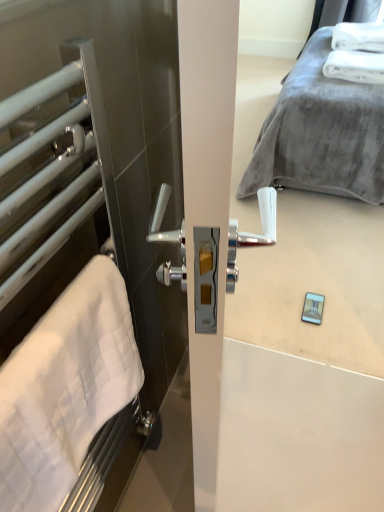
Question: Does white soft towel at upper right, the 1th bath towel positioned from the right, come in front of white matte towel rack at left?

Choices:
 (A) yes
 (B) no

Answer: (B)

Question: Does white soft towel at upper right, positioned as the first bath towel in back-to-front order, come behind white matte towel rack at left?

Choices:
 (A) yes
 (B) no

Answer: (A)

Question: Is white soft towel at upper right, the second bath towel viewed from the left, completely or partially outside of white matte towel rack at left?

Choices:
 (A) yes
 (B) no

Answer: (A)

Question: Considering the relative sizes of white soft towel at upper right, the 1th bath towel positioned from the right, and white matte towel rack at left in the image provided, is white soft towel at upper right, the 1th bath towel positioned from the right, thinner than white matte towel rack at left?

Choices:
 (A) no
 (B) yes

Answer: (A)

Question: Does white soft towel at upper right, the 2th bath towel ordered from the bottom, turn towards white matte towel rack at left?

Choices:
 (A) yes
 (B) no

Answer: (B)

Question: From the image's perspective, is white matte towel rack at left located above or below white soft towel at left, marked as the first bath towel in a bottom-to-top arrangement?

Choices:
 (A) above
 (B) below

Answer: (A)

Question: Considering their positions, is white matte towel rack at left located in front of or behind white soft towel at left, positioned as the second bath towel in back-to-front order?

Choices:
 (A) front
 (B) behind

Answer: (A)

Question: Based on their positions, is white matte towel rack at left located to the left or right of white soft towel at left, positioned as the second bath towel in back-to-front order?

Choices:
 (A) left
 (B) right

Answer: (A)

Question: Is white matte towel rack at left inside or outside of white soft towel at left, positioned as the second bath towel in back-to-front order?

Choices:
 (A) inside
 (B) outside

Answer: (B)

Question: From a real-world perspective, relative to white soft towel at upper right, the 2th bath towel ordered from the bottom, is white matte towel rack at left vertically above or below?

Choices:
 (A) above
 (B) below

Answer: (A)

Question: Considering the positions of point (31, 162) and point (379, 62), is point (31, 162) closer or farther from the camera than point (379, 62)?

Choices:
 (A) closer
 (B) farther

Answer: (A)

Question: Is white matte towel rack at left wider or thinner than white soft towel at upper right, arranged as the second bath towel when viewed from the front?

Choices:
 (A) thin
 (B) wide

Answer: (A)

Question: Based on their positions, is white matte towel rack at left located to the left or right of white soft towel at upper right, the second bath towel viewed from the left?

Choices:
 (A) right
 (B) left

Answer: (B)

Question: From the image's perspective, is white soft towel at upper right, arranged as the second bath towel when viewed from the front, positioned above or below white matte towel rack at left?

Choices:
 (A) above
 (B) below

Answer: (A)

Question: Looking at their shapes, would you say white soft towel at upper right, the second bath towel viewed from the left, is wider or thinner than white matte towel rack at left?

Choices:
 (A) thin
 (B) wide

Answer: (B)